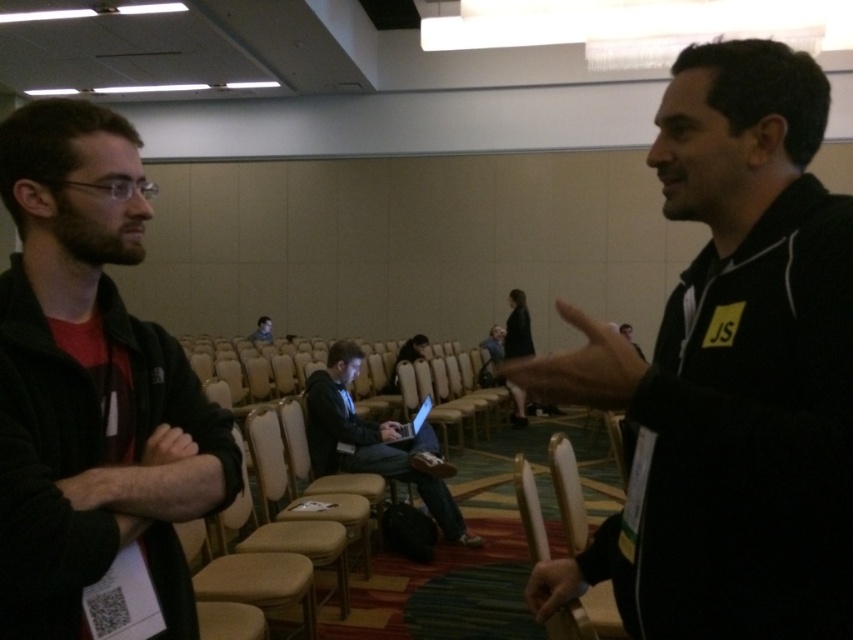
Question: Which object appears closest to the camera in this image?

Choices:
 (A) black matte jacket at right
 (B) light brown leather chair at center
 (C) dark green jacket at left
 (D) silver metallic laptop at center

Answer: (A)

Question: Which point is closer to the camera?

Choices:
 (A) light brown leather chair at center
 (B) silver metallic laptop at center
 (C) black matte jacket at right

Answer: (C)

Question: Does black matte jacket at right have a lesser width compared to silver metallic laptop at center?

Choices:
 (A) yes
 (B) no

Answer: (B)

Question: Is black matte jacket at right below dark gray fabric jacket at center?

Choices:
 (A) no
 (B) yes

Answer: (A)

Question: Which object appears closest to the camera in this image?

Choices:
 (A) dark green jacket at left
 (B) silver metallic laptop at center

Answer: (A)

Question: Is the position of black matte jacket at right less distant than that of silver metallic laptop at center?

Choices:
 (A) yes
 (B) no

Answer: (A)